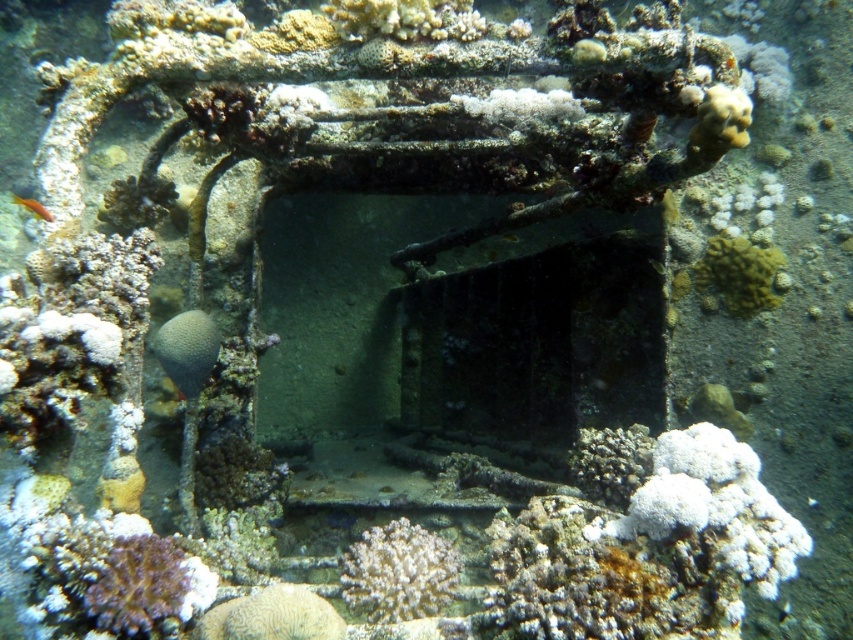
Who is more forward, [444,548] or [15,202]?

Positioned in front is point [444,548].

Is white coral at center closer to the viewer compared to orange matte fish at lower left?

Yes, white coral at center is in front of orange matte fish at lower left.

Who is more forward, (387, 605) or (44, 209)?

Point (387, 605) is in front.

This screenshot has width=853, height=640. I want to click on white coral at center, so click(398, 572).

Image resolution: width=853 pixels, height=640 pixels. Describe the element at coordinates (187, 349) in the screenshot. I see `gray matte coral at center` at that location.

Identify the location of gray matte coral at center. point(187,349).

Is point (189, 364) less distant than point (18, 204)?

Yes, it is.

Identify the location of gray matte coral at center. (187, 349).

Which of these two, white coral at center or yellow coral at center, stands shorter?

With less height is white coral at center.

In the scene shown: Who is positioned more to the left, white coral at center or yellow coral at center?

white coral at center

This screenshot has width=853, height=640. Describe the element at coordinates (398, 572) in the screenshot. I see `white coral at center` at that location.

You are a GUI agent. You are given a task and a screenshot of the screen. Output one action in this format:
    pyautogui.click(x=<x>, y=<y>)
    Task: Click on the white coral at center
    The width and height of the screenshot is (853, 640).
    Given the screenshot: What is the action you would take?
    pyautogui.click(x=398, y=572)